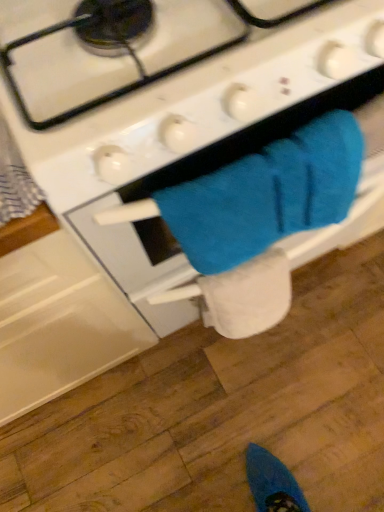
Question: Considering the relative positions of white matte gas stove at center and white soft toilet paper at lower center in the image provided, is white matte gas stove at center to the left of white soft toilet paper at lower center from the viewer's perspective?

Choices:
 (A) no
 (B) yes

Answer: (B)

Question: Is white matte gas stove at center shorter than white soft toilet paper at lower center?

Choices:
 (A) yes
 (B) no

Answer: (B)

Question: From the image's perspective, is white matte gas stove at center under white soft toilet paper at lower center?

Choices:
 (A) no
 (B) yes

Answer: (A)

Question: Does white matte gas stove at center appear on the right side of white soft toilet paper at lower center?

Choices:
 (A) yes
 (B) no

Answer: (B)

Question: Is white matte gas stove at center touching white soft toilet paper at lower center?

Choices:
 (A) yes
 (B) no

Answer: (B)

Question: From the image's perspective, is white matte gas stove at center above or below white soft toilet paper at lower center?

Choices:
 (A) below
 (B) above

Answer: (B)

Question: Which is correct: white matte gas stove at center is inside white soft toilet paper at lower center, or outside of it?

Choices:
 (A) outside
 (B) inside

Answer: (A)

Question: Considering the positions of white matte gas stove at center and white soft toilet paper at lower center in the image, is white matte gas stove at center bigger or smaller than white soft toilet paper at lower center?

Choices:
 (A) big
 (B) small

Answer: (A)

Question: Is white matte gas stove at center to the left or to the right of white soft toilet paper at lower center in the image?

Choices:
 (A) left
 (B) right

Answer: (A)

Question: Considering the positions of white soft toilet paper at lower center and white matte gas stove at center in the image, is white soft toilet paper at lower center bigger or smaller than white matte gas stove at center?

Choices:
 (A) small
 (B) big

Answer: (A)

Question: Considering the positions of white soft toilet paper at lower center and white matte gas stove at center in the image, is white soft toilet paper at lower center wider or thinner than white matte gas stove at center?

Choices:
 (A) wide
 (B) thin

Answer: (B)

Question: Is white soft toilet paper at lower center to the left or to the right of white matte gas stove at center in the image?

Choices:
 (A) right
 (B) left

Answer: (A)

Question: Is white soft toilet paper at lower center situated inside white matte gas stove at center or outside?

Choices:
 (A) inside
 (B) outside

Answer: (A)

Question: Is white matte gas stove at center in front of or behind blue fuzzy towel at center in the image?

Choices:
 (A) front
 (B) behind

Answer: (A)

Question: Does point (102, 105) appear closer or farther from the camera than point (249, 174)?

Choices:
 (A) farther
 (B) closer

Answer: (B)